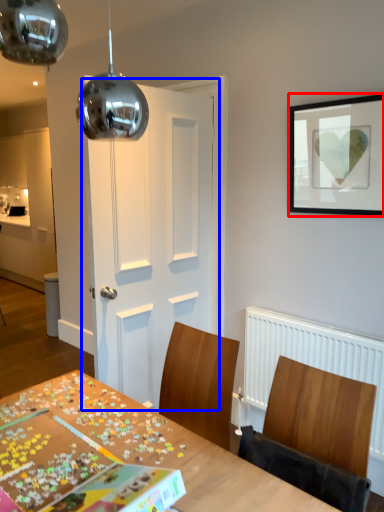
Question: Which of the following is the farthest to the observer, picture frame (highlighted by a red box) or door (highlighted by a blue box)?

Choices:
 (A) picture frame
 (B) door

Answer: (B)